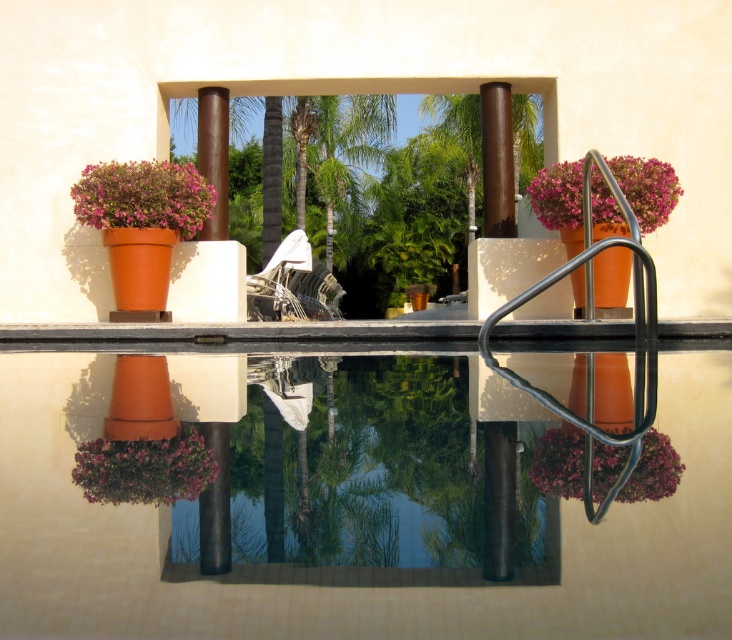
Question: Which of these objects is positioned closest to the matte terracotta pot at left?

Choices:
 (A) transparent glass water at center
 (B) purple matte flower pot at lower left
 (C) matte terracotta pot at right

Answer: (C)

Question: Can you confirm if matte terracotta pot at left is wider than matte terracotta pot at right?

Choices:
 (A) yes
 (B) no

Answer: (B)

Question: Is matte terracotta pot at left below matte terracotta pot at right?

Choices:
 (A) no
 (B) yes

Answer: (A)

Question: Is matte terracotta pot at right above matte terracotta pot at lower right?

Choices:
 (A) yes
 (B) no

Answer: (A)

Question: Which of these objects is positioned farthest from the matte terracotta pot at lower right?

Choices:
 (A) matte terracotta pot at right
 (B) transparent glass water at center

Answer: (A)

Question: Which of the following is the closest to the observer?

Choices:
 (A) matte terracotta pot at right
 (B) purple matte flower pot at lower left
 (C) transparent glass water at center
 (D) matte terracotta pot at left

Answer: (C)